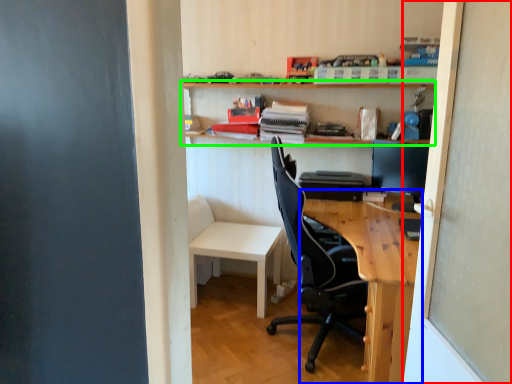
Question: Which object is positioned closest to screen door (highlighted by a red box)? Select from desk (highlighted by a blue box) and shelf (highlighted by a green box).

Choices:
 (A) desk
 (B) shelf

Answer: (A)